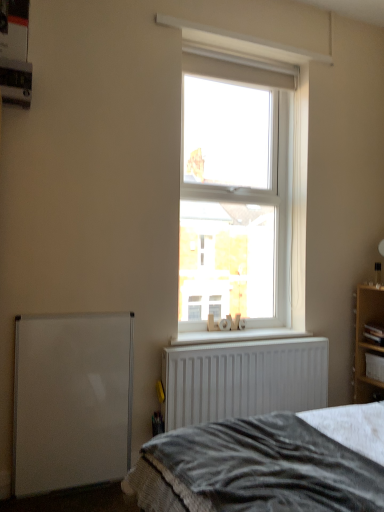
You are a GUI agent. You are given a task and a screenshot of the screen. Output one action in this format:
    pyautogui.click(x=<x>, y=<y>)
    Task: Click on the free point above white matte whiteboard at lower left (from a real-world perspective)
    
    Given the screenshot: What is the action you would take?
    pyautogui.click(x=81, y=314)